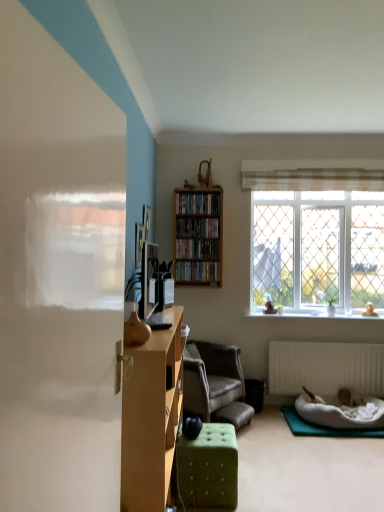
Question: Choose the correct answer: Is green tufted ottoman at center inside wooden shelf at center, arranged as the first book when viewed from the top, or outside it?

Choices:
 (A) inside
 (B) outside

Answer: (B)

Question: Based on their sizes in the image, would you say green tufted ottoman at center is bigger or smaller than wooden shelf at center, the fourth book positioned from the bottom?

Choices:
 (A) small
 (B) big

Answer: (B)

Question: Which of these objects is positioned closest to the wooden shelf at upper center, the 3th book from the bottom?

Choices:
 (A) green fabric ottoman at lower center
 (B) green felt yoga mat at lower right
 (C) white plush pet bed at lower right
 (D) green leafy plant at window
 (E) wooden shelf at center, arranged as the first book when viewed from the top

Answer: (E)

Question: Which object is positioned closest to the matte brown vase at center?

Choices:
 (A) wooden bookshelf at center, which is counted as the 2th book, starting from the bottom
 (B) wooden shelf at upper center, the 3th book from the bottom
 (C) wooden cabinet at center-left
 (D) clear glass window at upper right
 (E) black matte speaker at lower center

Answer: (C)